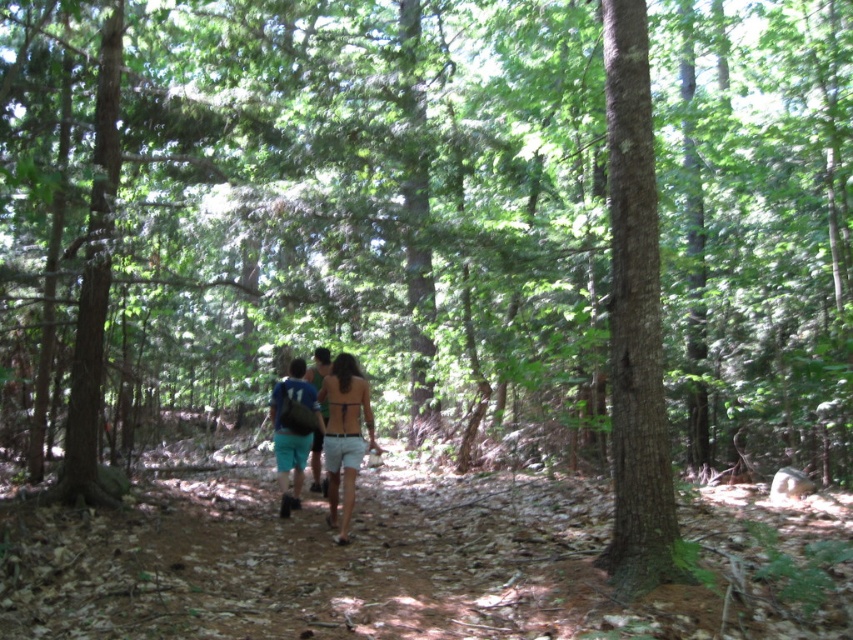
Question: Can you confirm if tan fabric bikini top at center is positioned to the left of blue fabric backpack at center?

Choices:
 (A) no
 (B) yes

Answer: (A)

Question: Based on their relative distances, which object is farther from the brown rough bark tree at center right?

Choices:
 (A) green fabric shorts at center
 (B) blue fabric backpack at center

Answer: (A)

Question: Which point is closer to the camera taking this photo?

Choices:
 (A) 291,365
 (B) 645,380
 (C) 369,449
 (D) 322,353

Answer: (B)

Question: Which of the following is the closest to the observer?

Choices:
 (A) (350, 380)
 (B) (326, 371)
 (C) (288, 416)
 (D) (654, 272)

Answer: (D)

Question: Is tan fabric bikini top at center to the left of blue fabric backpack at center from the viewer's perspective?

Choices:
 (A) yes
 (B) no

Answer: (B)

Question: Is brown rough bark tree at center right above blue fabric backpack at center?

Choices:
 (A) yes
 (B) no

Answer: (A)